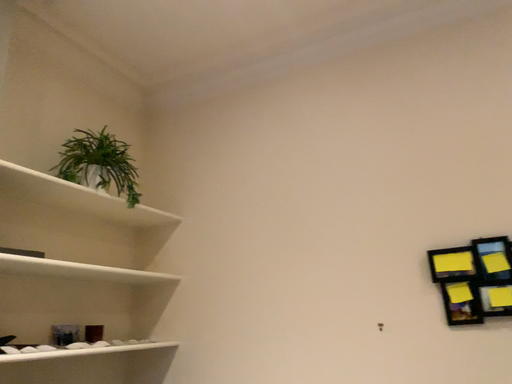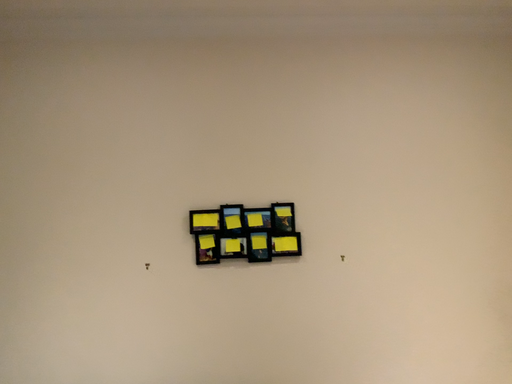
Question: Which way did the camera rotate in the video?

Choices:
 (A) rotated left
 (B) rotated right

Answer: (B)